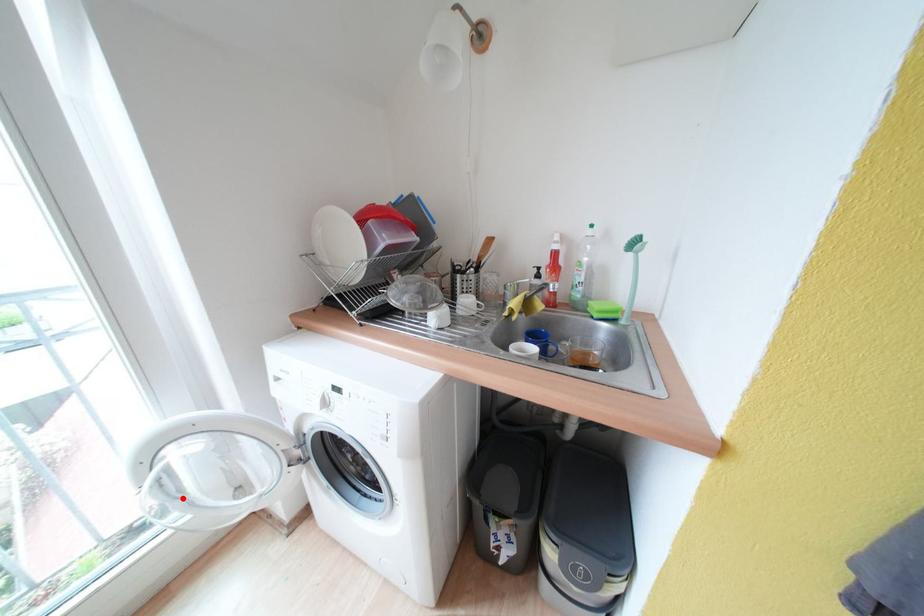
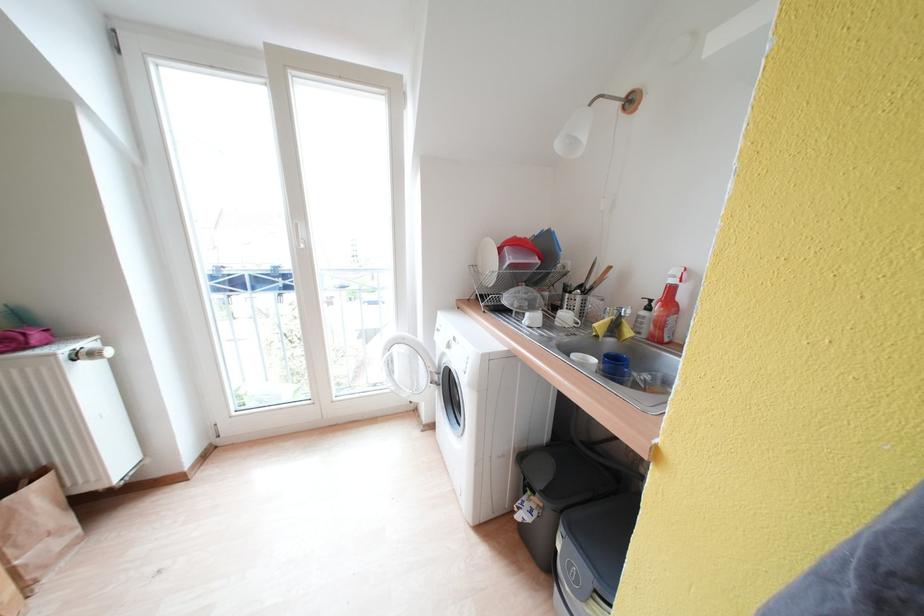
Question: I am providing you with two images of the same scene from different viewpoints. Image1 has a red point marked. In image2, the corresponding 3D location appears at what relative position? Reply with the corresponding letter.

Choices:
 (A) Closer
 (B) Farther

Answer: (B)